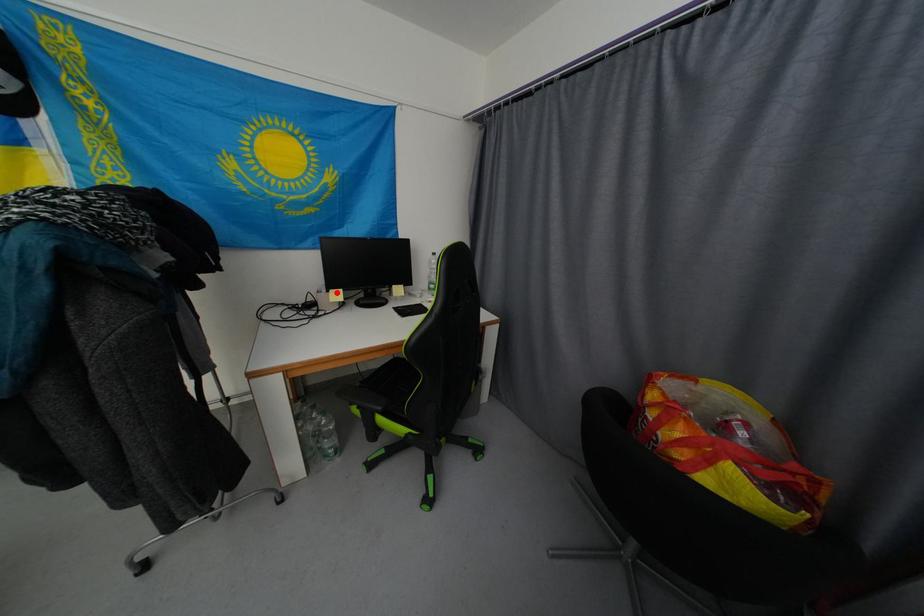
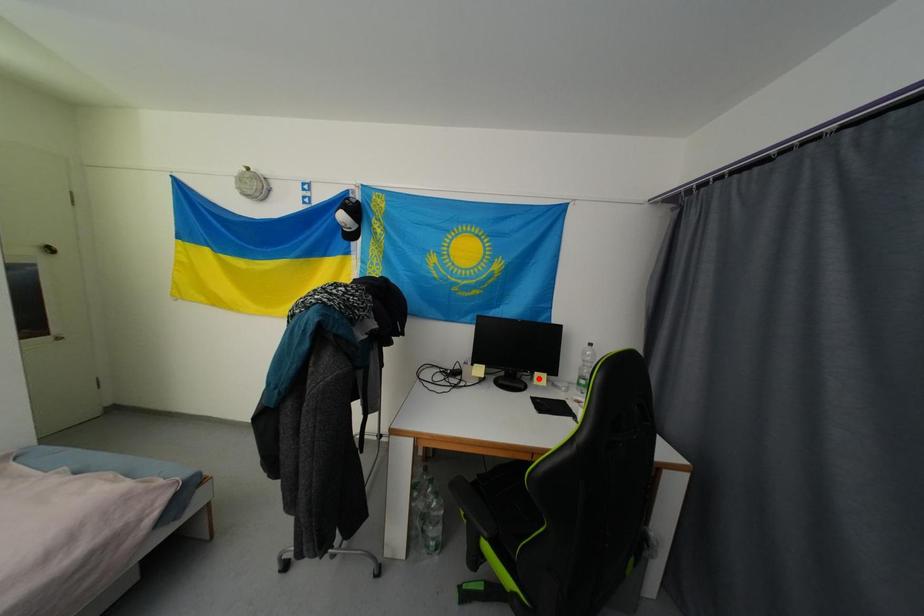
I am providing you with two images of the same scene from different viewpoints. A red point is marked on the first image and another point is marked on the second image. Are the points marked in image1 and image2 representing the same 3D position?

No